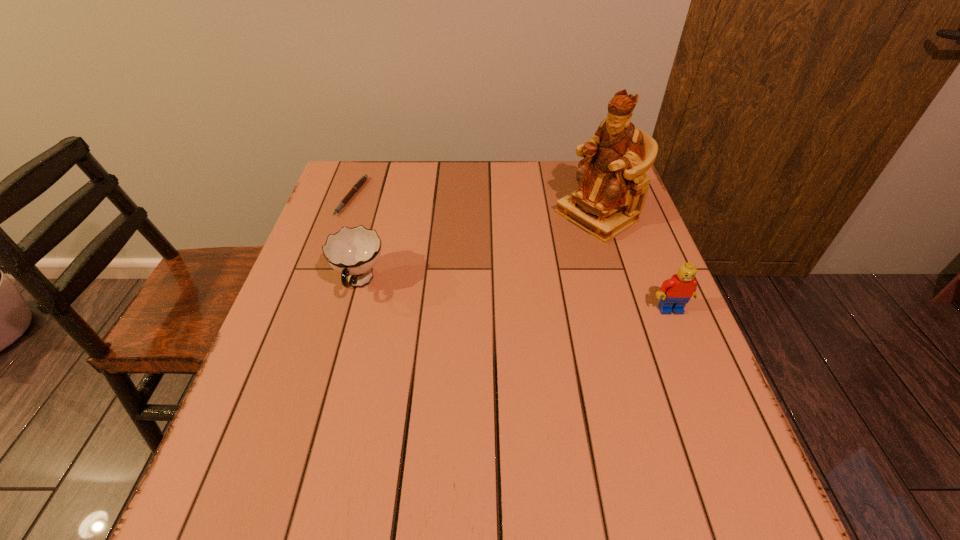
Locate an element on the screen. free space on the desktop that is between the third tallest object and the third shortest object and is positioned on the front-facing side of the tallest object is located at coordinates point(466,292).

Identify the location of free space on the desktop that is between the second shortest object and the third shortest object and is positioned at the nib of the shortest object. Image resolution: width=960 pixels, height=540 pixels. (465, 292).